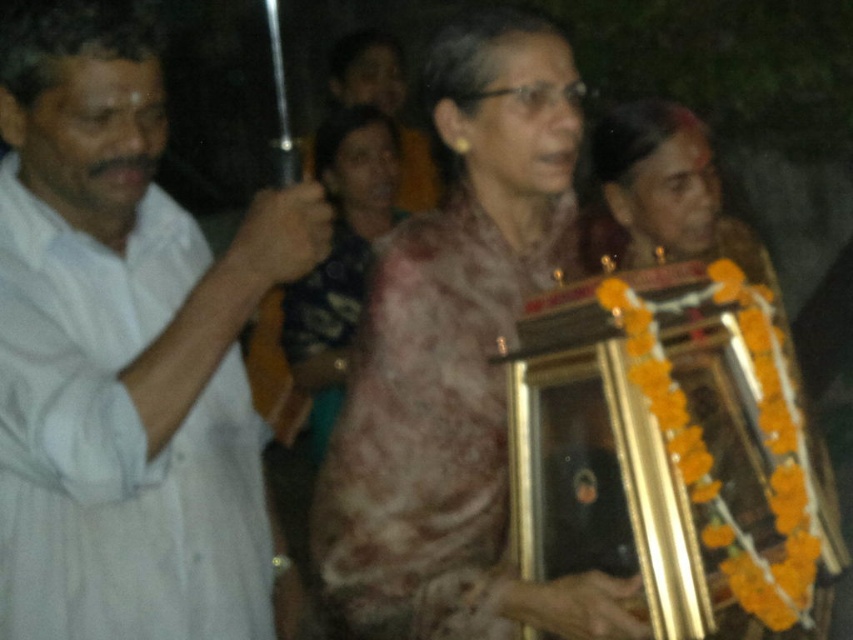
You are attending a formal event and notice two people in the scene. The first person is wearing a white cotton shirt at left, and the second is wearing a matte pink saree at center. Based on their positions, which clothing item is lower in the image?

The white cotton shirt at left is below the matte pink saree at center in the image.

Consider the image. You are a photographer at the event and want to capture a clear photo of the pink floral sari at center without the white cotton shirt at left blocking it. What should you do?

Move the camera to the right side so that the white cotton shirt at left is no longer in front of the pink floral sari at center.